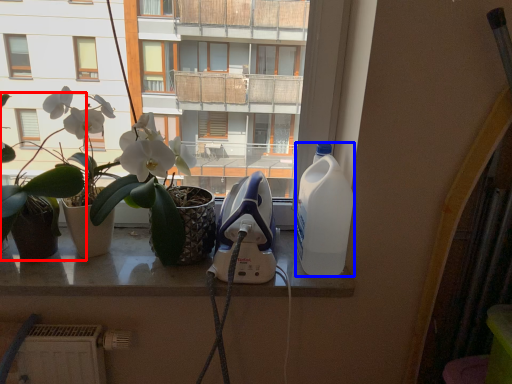
Question: Which of the following is the closest to the observer, houseplant (highlighted by a red box) or bottle (highlighted by a blue box)?

Choices:
 (A) houseplant
 (B) bottle

Answer: (A)